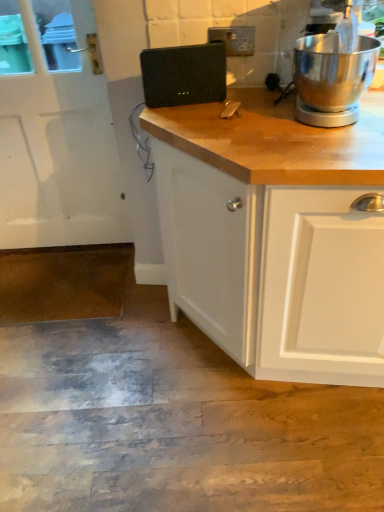
Find the location of a particular element. The image size is (384, 512). white matte screen door at left is located at coordinates (55, 130).

Describe the element at coordinates (55, 130) in the screenshot. The width and height of the screenshot is (384, 512). I see `white matte screen door at left` at that location.

Where is `black plastic speaker at center`? black plastic speaker at center is located at coordinates (184, 75).

From the image's perspective, is white matte screen door at left above or below polished stainless steel stand mixer at upper right?

Based on their image positions, white matte screen door at left is located beneath polished stainless steel stand mixer at upper right.

Measure the distance between white matte screen door at left and polished stainless steel stand mixer at upper right.

The distance of white matte screen door at left from polished stainless steel stand mixer at upper right is 39.08 inches.

Who is bigger, white matte screen door at left or polished stainless steel stand mixer at upper right?

Bigger between the two is white matte screen door at left.

Is the surface of white matte screen door at left in direct contact with polished stainless steel stand mixer at upper right?

No, white matte screen door at left is not next to polished stainless steel stand mixer at upper right.

How many degrees apart are the facing directions of black plastic speaker at center and polished stainless steel stand mixer at upper right?

The angle between the facing direction of black plastic speaker at center and the facing direction of polished stainless steel stand mixer at upper right is 14.8 degrees.

Can you confirm if black plastic speaker at center is smaller than polished stainless steel stand mixer at upper right?

Correct, black plastic speaker at center occupies less space than polished stainless steel stand mixer at upper right.

In the image, is black plastic speaker at center positioned in front of or behind polished stainless steel stand mixer at upper right?

black plastic speaker at center is positioned farther from the viewer than polished stainless steel stand mixer at upper right.

Is black plastic speaker at center not within polished stainless steel stand mixer at upper right?

Absolutely, black plastic speaker at center is external to polished stainless steel stand mixer at upper right.

Visually, is white matte screen door at left positioned to the left or to the right of black plastic speaker at center?

Based on their positions, white matte screen door at left is located to the left of black plastic speaker at center.

Where is `screen door lying on the left of black plastic speaker at center`? The image size is (384, 512). screen door lying on the left of black plastic speaker at center is located at coordinates (55, 130).

Is white matte screen door at left further to camera compared to black plastic speaker at center?

Yes, white matte screen door at left is behind black plastic speaker at center.

What's the angular difference between white matte screen door at left and black plastic speaker at center's facing directions?

The facing directions of white matte screen door at left and black plastic speaker at center are 6.64 degrees apart.

In terms of width, does polished stainless steel stand mixer at upper right look wider or thinner when compared to black plastic speaker at center?

Considering their sizes, polished stainless steel stand mixer at upper right looks broader than black plastic speaker at center.

Is polished stainless steel stand mixer at upper right positioned behind black plastic speaker at center?

No, polished stainless steel stand mixer at upper right is closer to the viewer.

Which is correct: polished stainless steel stand mixer at upper right is inside black plastic speaker at center, or outside of it?

polished stainless steel stand mixer at upper right is not inside black plastic speaker at center, it's outside.

Between point (297, 49) and point (33, 83), which one is positioned behind?

The point (33, 83) is farther.

Measure the distance from polished stainless steel stand mixer at upper right to white matte screen door at left.

The distance of polished stainless steel stand mixer at upper right from white matte screen door at left is 39.08 inches.

Can you confirm if polished stainless steel stand mixer at upper right is positioned to the right of white matte screen door at left?

Yes, polished stainless steel stand mixer at upper right is to the right of white matte screen door at left.

Between polished stainless steel stand mixer at upper right and white matte screen door at left, which one has smaller size?

polished stainless steel stand mixer at upper right.

From a real-world perspective, does black plastic speaker at center stand above white matte screen door at left?

Indeed, from a real-world perspective, black plastic speaker at center stands above white matte screen door at left.

Considering the relative sizes of black plastic speaker at center and white matte screen door at left in the image provided, is black plastic speaker at center taller than white matte screen door at left?

No.

How much distance is there between black plastic speaker at center and white matte screen door at left?

black plastic speaker at center and white matte screen door at left are 25.64 inches apart from each other.

The image size is (384, 512). In the image, there is a white matte screen door at left. Find the location of `home appliance above it (from the image's perspective)`. home appliance above it (from the image's perspective) is located at coordinates (331, 78).

Find the location of a particular element. appliance that is below the polished stainless steel stand mixer at upper right (from the image's perspective) is located at coordinates (184, 75).

Looking at the image, which one is located closer to white matte screen door at left, polished stainless steel stand mixer at upper right or black plastic speaker at center?

black plastic speaker at center is closer to white matte screen door at left.

Considering their positions, is white matte screen door at left positioned closer to polished stainless steel stand mixer at upper right than black plastic speaker at center?

black plastic speaker at center lies closer to polished stainless steel stand mixer at upper right than the other object.

Considering their positions, is white matte screen door at left positioned further to black plastic speaker at center than polished stainless steel stand mixer at upper right?

white matte screen door at left is positioned further to the anchor black plastic speaker at center.

From the image, which object appears to be nearer to black plastic speaker at center, polished stainless steel stand mixer at upper right or white matte screen door at left?

Based on the image, polished stainless steel stand mixer at upper right appears to be nearer to black plastic speaker at center.

Considering their positions, is black plastic speaker at center positioned further to polished stainless steel stand mixer at upper right than white matte screen door at left?

The object further to polished stainless steel stand mixer at upper right is white matte screen door at left.

Looking at the image, which one is located closer to white matte screen door at left, black plastic speaker at center or polished stainless steel stand mixer at upper right?

Based on the image, black plastic speaker at center appears to be nearer to white matte screen door at left.

Where is `appliance between white matte screen door at left and polished stainless steel stand mixer at upper right`? appliance between white matte screen door at left and polished stainless steel stand mixer at upper right is located at coordinates (184, 75).